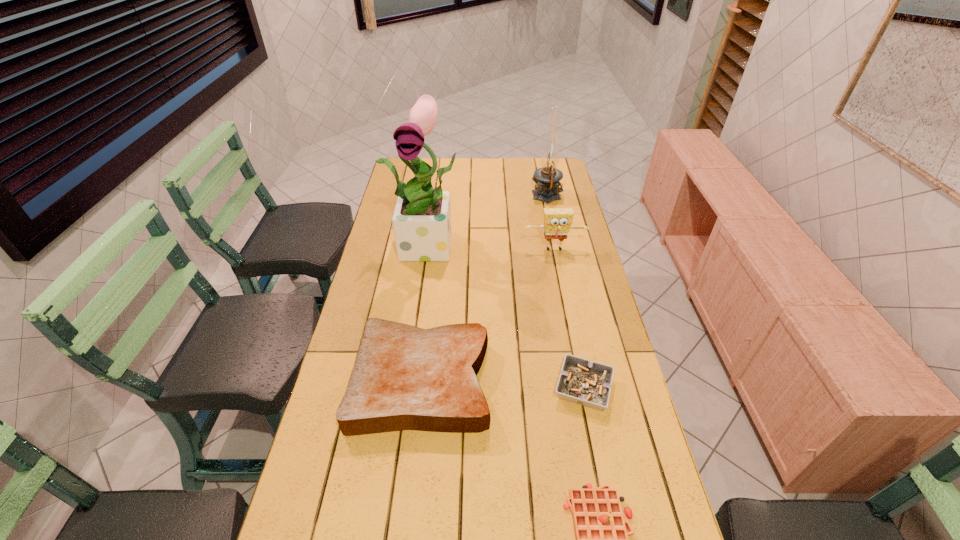
Locate an element on the screen. the tallest object is located at coordinates tap(421, 221).

This screenshot has height=540, width=960. Identify the location of oil lamp. (547, 178).

Image resolution: width=960 pixels, height=540 pixels. What are the coordinates of `the second tallest object` in the screenshot? It's located at (547, 178).

This screenshot has width=960, height=540. What are the coordinates of `sponge` in the screenshot? It's located at (557, 222).

Find the location of a particular element. The height and width of the screenshot is (540, 960). the third shortest object is located at coordinates (404, 378).

Find the location of `ashtray`. ashtray is located at coordinates (586, 383).

Find the location of a particular element. The height and width of the screenshot is (540, 960). free location located on the front-facing side of the tallest object is located at coordinates (424, 300).

Identify the location of free space located 0.310m on the front of the oil lamp. (559, 256).

Where is `blank area located on the face of the sponge`? The width and height of the screenshot is (960, 540). blank area located on the face of the sponge is located at coordinates (558, 267).

Where is `free space located on the right of the fourth tallest object`? The width and height of the screenshot is (960, 540). free space located on the right of the fourth tallest object is located at coordinates (512, 380).